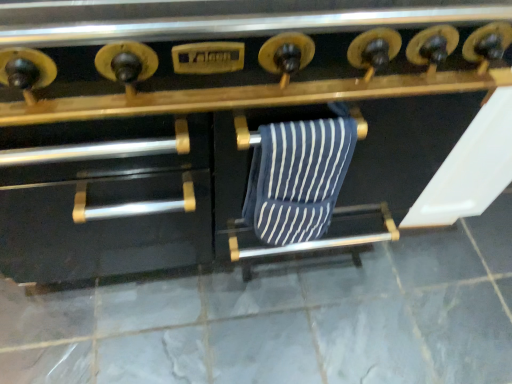
This screenshot has height=384, width=512. What do you see at coordinates (297, 178) in the screenshot? I see `navy blue striped towel at center` at bounding box center [297, 178].

The height and width of the screenshot is (384, 512). In order to click on navy blue striped towel at center in this screenshot , I will do `click(297, 178)`.

I want to click on navy blue striped towel at center, so click(x=297, y=178).